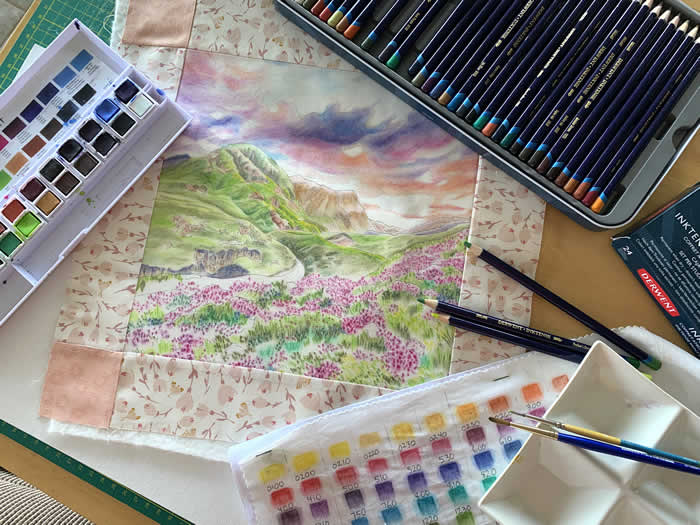
The width and height of the screenshot is (700, 525). I want to click on brown table top surface, so click(x=573, y=284), click(x=73, y=490), click(x=10, y=37).